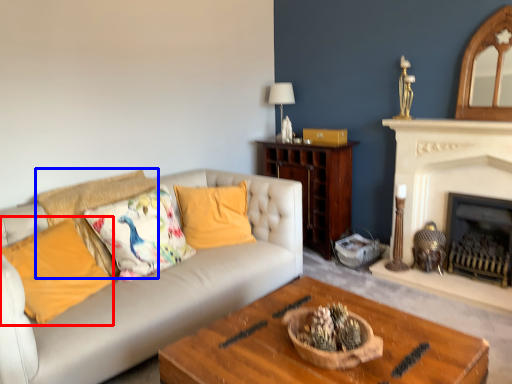
Question: Which object appears farthest to the camera in this image, pillow (highlighted by a red box) or pillow (highlighted by a blue box)?

Choices:
 (A) pillow
 (B) pillow

Answer: (B)